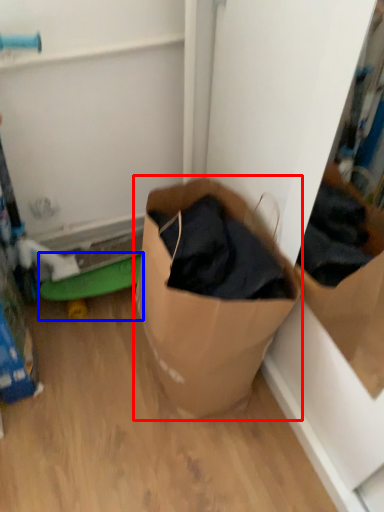
Question: Which object appears closest to the camera in this image, box (highlighted by a red box) or toy (highlighted by a blue box)?

Choices:
 (A) box
 (B) toy

Answer: (A)